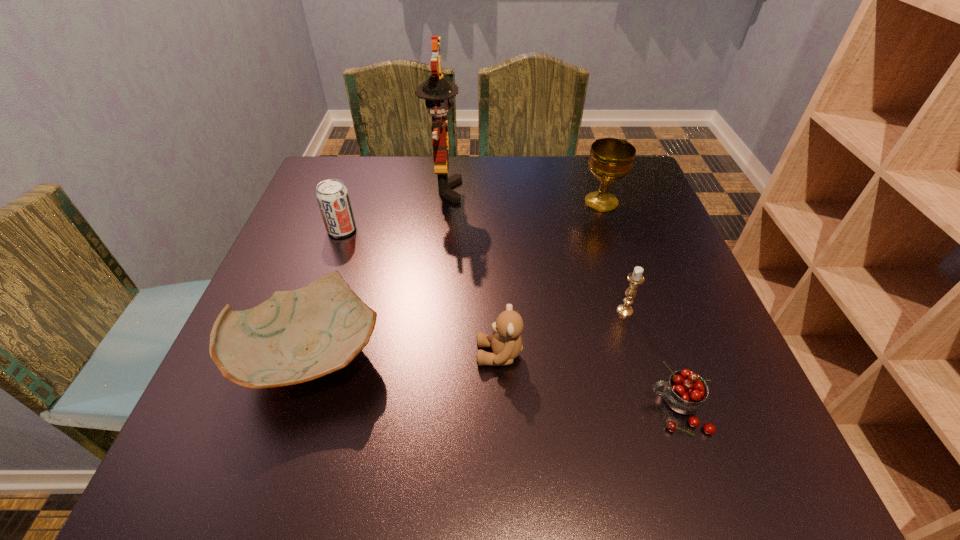
You are a GUI agent. You are given a task and a screenshot of the screen. Output one action in this format:
    pyautogui.click(x=<x>, y=<y>)
    Task: Click on the free space at the near edge of the desktop
    The height and width of the screenshot is (540, 960).
    Given the screenshot: What is the action you would take?
    pyautogui.click(x=421, y=474)

Locate an element on the screen. The width and height of the screenshot is (960, 540). blank space at the right edge of the desktop is located at coordinates (655, 224).

Where is `vacant space at the far left corner of the desktop`? vacant space at the far left corner of the desktop is located at coordinates (371, 179).

The image size is (960, 540). I want to click on vacant region at the far right corner of the desktop, so click(649, 205).

Image resolution: width=960 pixels, height=540 pixels. I want to click on free space between the soda can and the fourth object from left to right, so click(x=420, y=292).

Find the location of a particular element. The height and width of the screenshot is (540, 960). unoccupied position between the cherry and the candle holder is located at coordinates (651, 360).

I want to click on empty location between the teddy bear and the sixth shortest object, so click(550, 279).

Identify the location of free space between the candle holder and the fourth object from left to right. The height and width of the screenshot is (540, 960). (563, 333).

You are a GUI agent. You are given a task and a screenshot of the screen. Output one action in this format:
    pyautogui.click(x=<x>, y=<y>)
    Task: Click on the empty space that is in between the cherry and the candle holder
    The width and height of the screenshot is (960, 540).
    Given the screenshot: What is the action you would take?
    pyautogui.click(x=651, y=360)

The height and width of the screenshot is (540, 960). What are the coordinates of `free space between the nutcracker and the candle holder` in the screenshot? It's located at (535, 251).